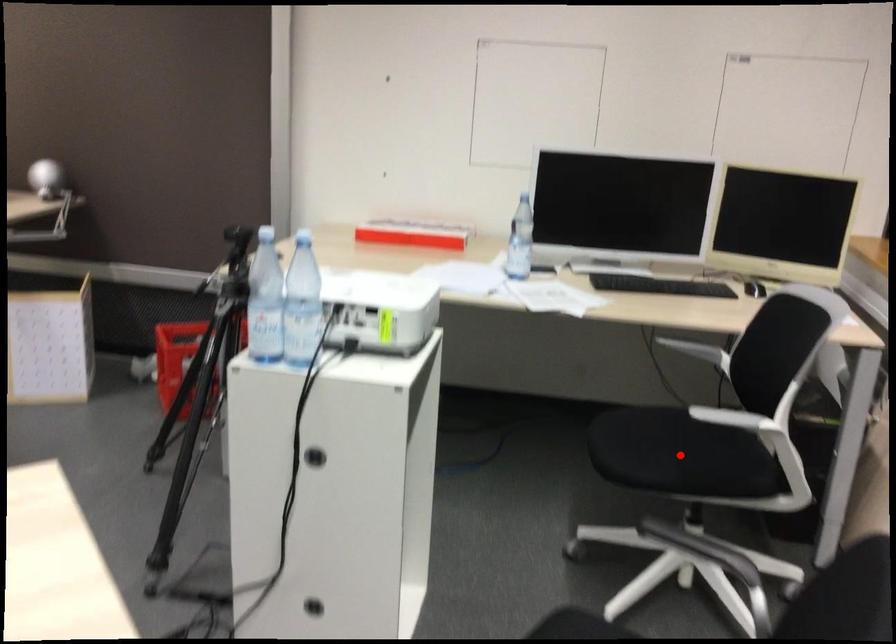
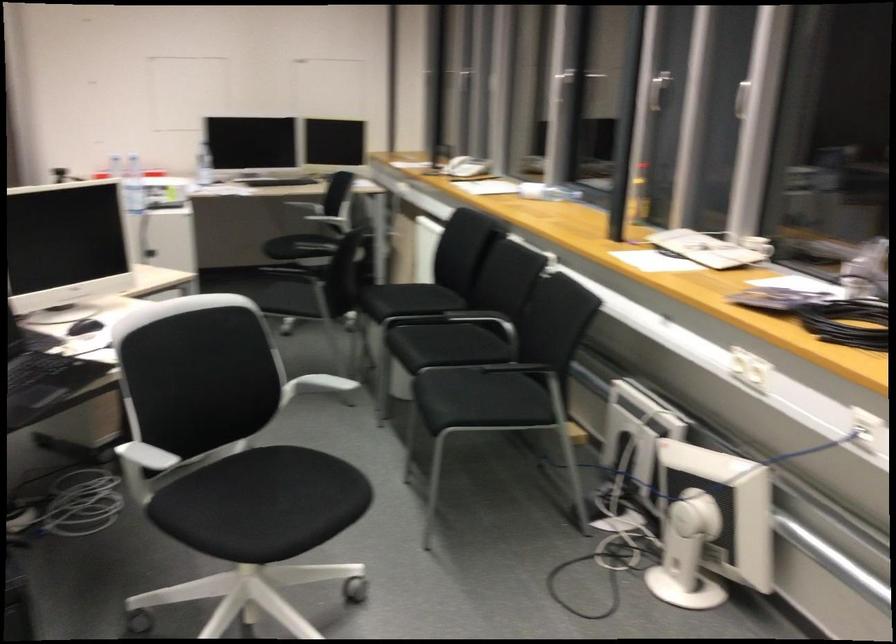
Where in the second image is the point corresponding to the highlighted location from the first image?

(309, 240)